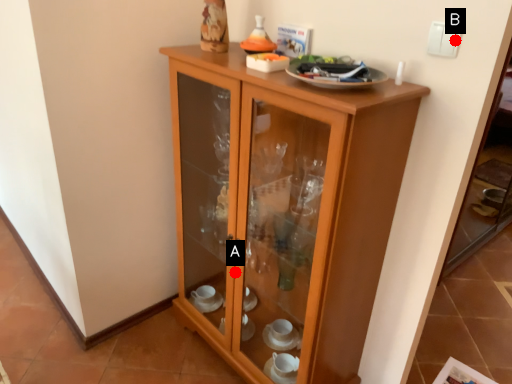
Question: Two points are circled on the image, labeled by A and B beside each circle. Which of the following is the closest to the observer?

Choices:
 (A) A is closer
 (B) B is closer

Answer: (B)